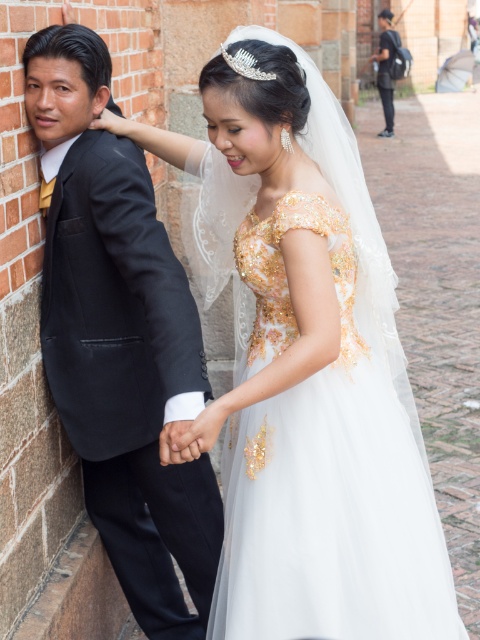
You are a photographer at a wedding venue and need to ensure that the white tulle dress at center and the dark blue jeans at upper right are visible in the photo. Given that the camera can only focus on objects within a 1.2 meter width, will both items fit within the frame?

The white tulle dress at center is smaller than dark blue jeans at upper right, so the camera can capture both items within the 1.2 meter width as long as their combined size does not exceed the limit.

In the scene shown: You are a photographer at a wedding venue. You need to position the white tulle dress at center and the dark blue jeans at upper right for a group photo. Which object should you adjust to ensure both are visible in the frame?

The dark blue jeans at upper right should be adjusted because the white tulle dress at center is in front of it, potentially blocking the view of the dark blue jeans at upper right.

Based on the photo, you are a photographer setting up for a wedding photo. You need to position a spotlight on the object that is closer to the camera. Which object should you choose between the matte black suit at left and the dark blue jeans at upper right?

The matte black suit at left is closer to the viewer than the dark blue jeans at upper right, so you should position the spotlight on the matte black suit at left.